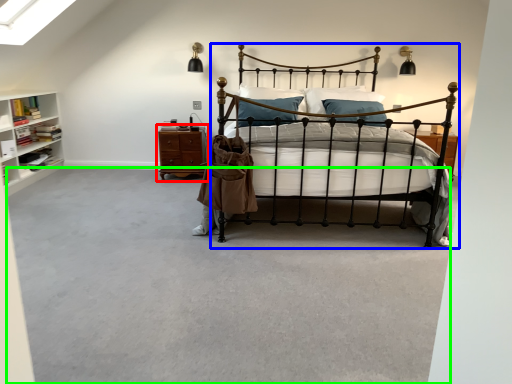
Question: Which is nearer to the nightstand (highlighted by a red box)? bed (highlighted by a blue box) or concrete (highlighted by a green box).

Choices:
 (A) bed
 (B) concrete

Answer: (B)